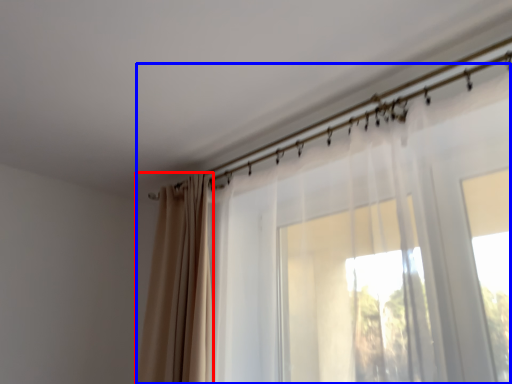
Question: Which object is further to the camera taking this photo, curtain (highlighted by a red box) or curtain (highlighted by a blue box)?

Choices:
 (A) curtain
 (B) curtain

Answer: (A)